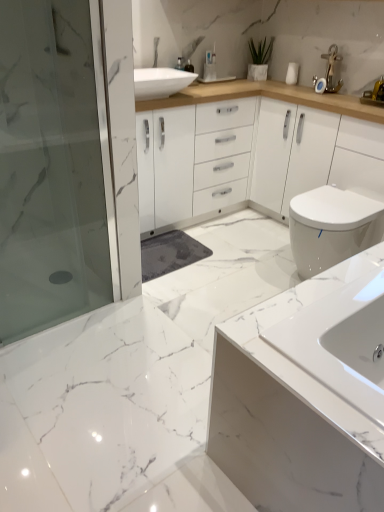
Question: Is white glossy toilet at right at the back of transparent glass shower door at left?

Choices:
 (A) no
 (B) yes

Answer: (A)

Question: Does transparent glass shower door at left have a smaller size compared to white glossy toilet at right?

Choices:
 (A) yes
 (B) no

Answer: (A)

Question: From a real-world perspective, is transparent glass shower door at left on top of white glossy toilet at right?

Choices:
 (A) yes
 (B) no

Answer: (A)

Question: Would you say transparent glass shower door at left contains white glossy toilet at right?

Choices:
 (A) no
 (B) yes

Answer: (A)

Question: From a real-world perspective, does transparent glass shower door at left sit lower than white glossy toilet at right?

Choices:
 (A) yes
 (B) no

Answer: (B)

Question: Is transparent glass shower door at left in contact with white glossy toilet at right?

Choices:
 (A) no
 (B) yes

Answer: (A)

Question: From a real-world perspective, is green matte plant at upper center below white glossy sink at lower right?

Choices:
 (A) yes
 (B) no

Answer: (B)

Question: Is green matte plant at upper center to the left of white glossy sink at lower right from the viewer's perspective?

Choices:
 (A) yes
 (B) no

Answer: (A)

Question: Is green matte plant at upper center located outside white glossy sink at lower right?

Choices:
 (A) yes
 (B) no

Answer: (A)

Question: Is green matte plant at upper center closer to the viewer compared to white glossy sink at lower right?

Choices:
 (A) yes
 (B) no

Answer: (B)

Question: From the image's perspective, is green matte plant at upper center beneath white glossy sink at lower right?

Choices:
 (A) no
 (B) yes

Answer: (A)

Question: Considering the relative sizes of green matte plant at upper center and white glossy sink at lower right in the image provided, is green matte plant at upper center taller than white glossy sink at lower right?

Choices:
 (A) no
 (B) yes

Answer: (A)

Question: Does white glossy sink at lower right have a greater width compared to transparent glass shower door at left?

Choices:
 (A) no
 (B) yes

Answer: (B)